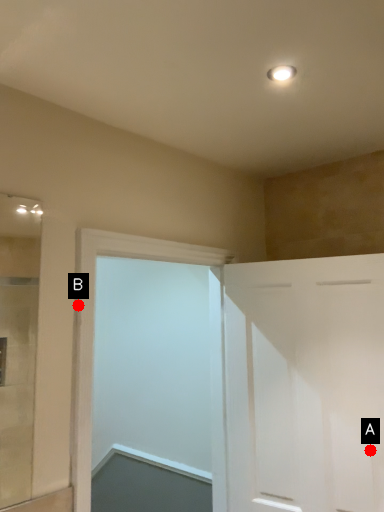
Question: Two points are circled on the image, labeled by A and B beside each circle. Which of the following is the closest to the observer?

Choices:
 (A) A is closer
 (B) B is closer

Answer: (B)